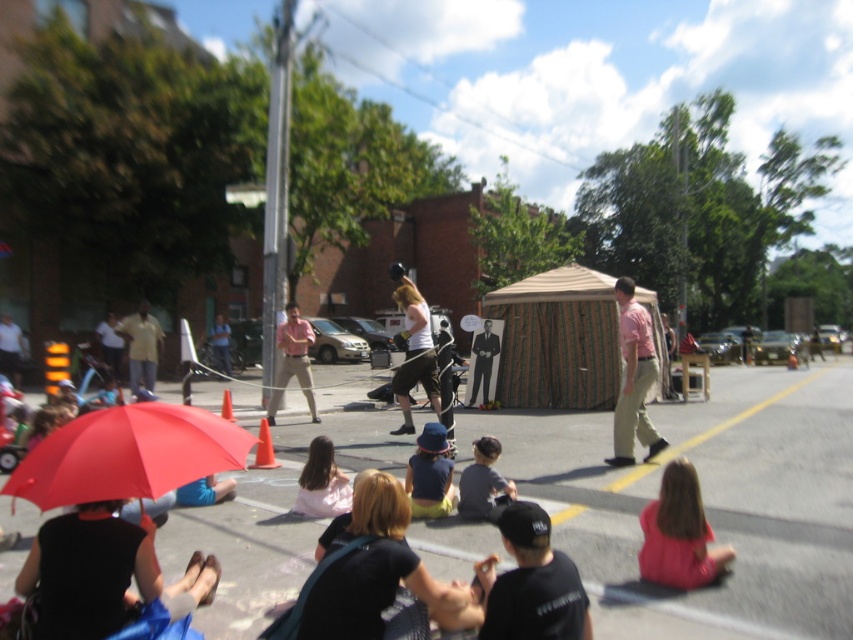
Can you confirm if white tank top at center is positioned to the left of light yellow shirt at left?

Incorrect, white tank top at center is not on the left side of light yellow shirt at left.

Is white tank top at center thinner than light yellow shirt at left?

Incorrect, white tank top at center's width is not less than light yellow shirt at left's.

Who is more forward, (405, 368) or (144, 300)?

Point (405, 368) is more forward.

Locate an element on the screen. This screenshot has width=853, height=640. white tank top at center is located at coordinates (413, 349).

Who is lower down, black matte cap at lower center or pink cotton shirt at center?

black matte cap at lower center

Does point (537, 634) come in front of point (633, 435)?

Yes, point (537, 634) is closer to viewer.

Find the location of `black matte cap at lower center`. black matte cap at lower center is located at coordinates (534, 582).

Can you confirm if black matte cap at lower center is positioned below white tank top at center?

Yes, black matte cap at lower center is below white tank top at center.

Which is behind, point (517, 579) or point (410, 365)?

Positioned behind is point (410, 365).

Find the location of a particular element. This screenshot has width=853, height=640. black matte cap at lower center is located at coordinates (534, 582).